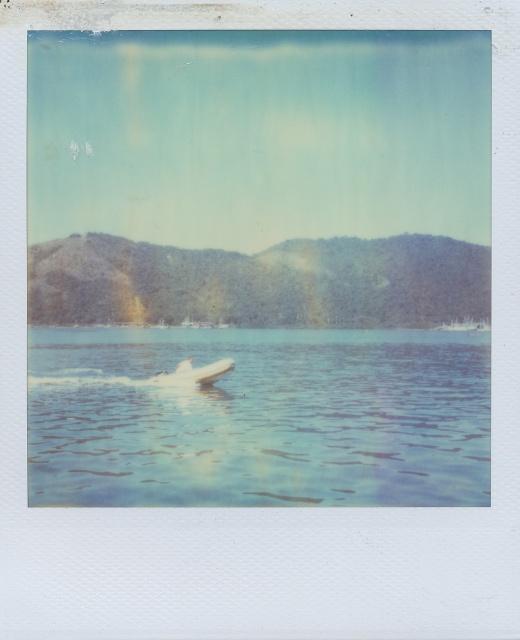
You are a photographer trying to capture the white glossy boat at center in your shot. The clear blue water at center is crucial for the reflection. How far apart are these two elements in the scene?

The clear blue water at center is 11.16 meters from the white glossy boat at center, so they are 11.16 meters apart.

You are a photographer trying to capture the white glossy boat at center in your shot. However, the clear blue water at center is blocking your view. Can you adjust your angle to see the boat?

The clear blue water at center is positioned over the white glossy boat at center, so adjusting your angle might allow you to see the boat beneath the water.